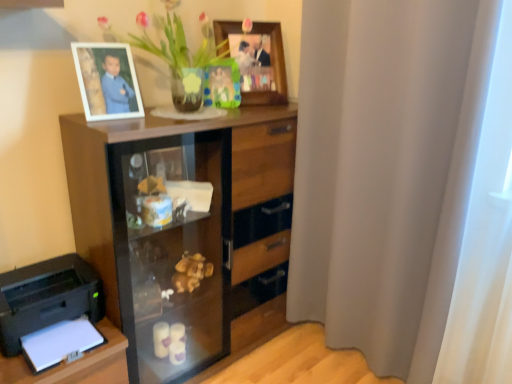
Locate an element on the screen. vacant area that is in front of wooden picture frame at upper center, the 3th picture frame in the left-to-right sequence is located at coordinates (248, 105).